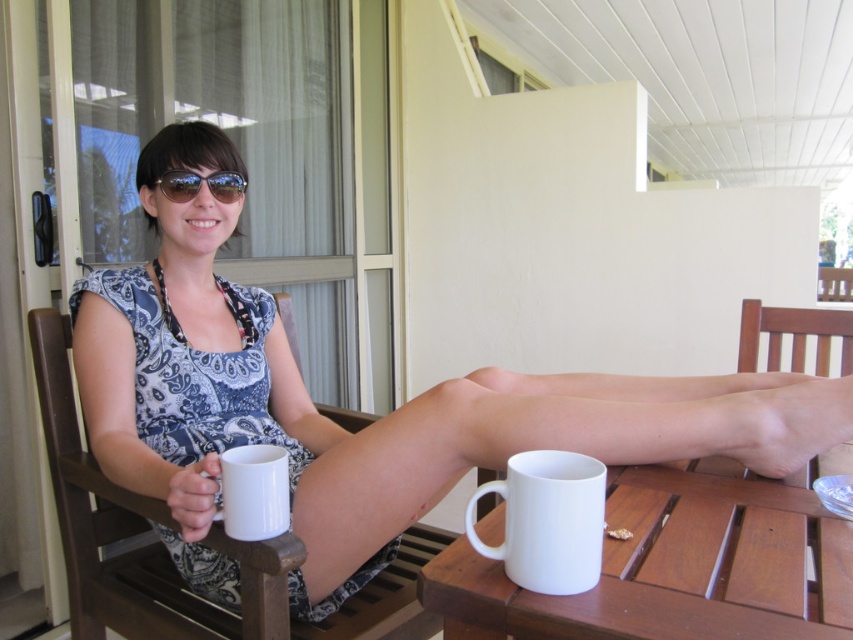
You are standing at the origin point in the image. Which direction should you walk to reach the wooden chair at lower right?

Since the wooden chair at lower right is located at point 0.883 on the x axis and 0.794 on the y axis, you should walk towards the lower right direction to reach it.

You are standing in the outdoor scene and want to know which of the two points, point (70,556) or point (556,563), is closer to you. Based on the image, which one is nearer?

Point (70,556) is closer to you because it is further to the viewer than point (556,563).

Looking at this image, you are standing in front of the porch and want to reach the point at coordinates point (251, 548). Considering the woman is sitting on the wooden chair, will you have to step over her to get there?

The point (251, 548) is 85.16 centimeters from the viewer, which is relatively close. Since the woman is sitting on the wooden chair, you would need to step around her to reach the point without disturbing her.